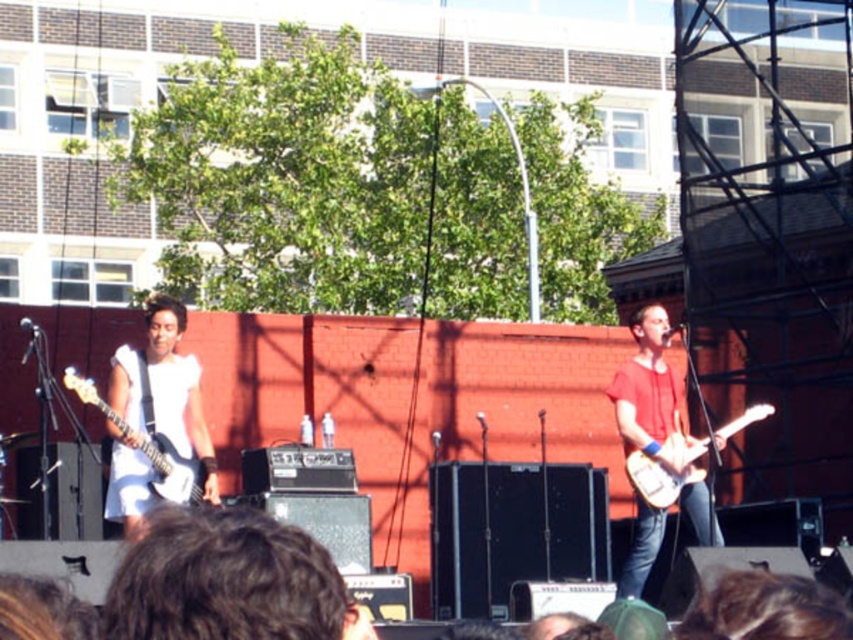
Between matte red guitar at right and white matte electric guitar at left, which one appears on the right side from the viewer's perspective?

Positioned to the right is matte red guitar at right.

What do you see at coordinates (648, 390) in the screenshot? I see `matte red guitar at right` at bounding box center [648, 390].

Is point (654, 550) in front of point (103, 412)?

That is False.

Find the location of a particular element. matte red guitar at right is located at coordinates (648, 390).

Does white glossy electric guitar at right appear under white matte electric guitar at left?

Yes.

Is white glossy electric guitar at right above white matte electric guitar at left?

No, white glossy electric guitar at right is not above white matte electric guitar at left.

What do you see at coordinates (665, 468) in the screenshot?
I see `white glossy electric guitar at right` at bounding box center [665, 468].

This screenshot has height=640, width=853. In order to click on white glossy electric guitar at right in this screenshot , I will do `click(665, 468)`.

Who is higher up, white matte guitar at left or white glossy electric guitar at right?

Positioned higher is white glossy electric guitar at right.

Is white matte guitar at left to the right of white glossy electric guitar at right from the viewer's perspective?

No, white matte guitar at left is not to the right of white glossy electric guitar at right.

The image size is (853, 640). I want to click on white matte guitar at left, so click(154, 413).

Find the location of a particular element. white matte guitar at left is located at coordinates (154, 413).